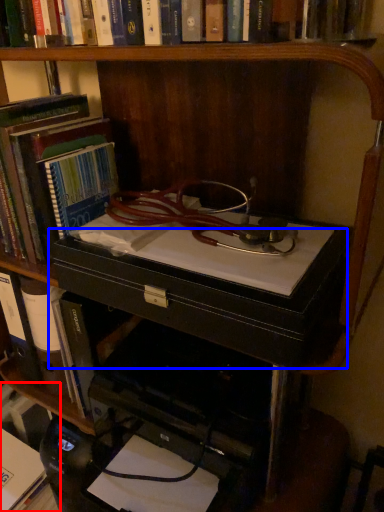
Question: Which point is closer to the camera, book (highlighted by a red box) or drawer (highlighted by a blue box)?

Choices:
 (A) book
 (B) drawer

Answer: (B)